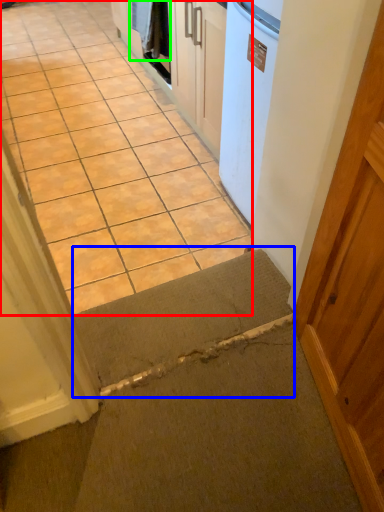
Question: Considering the real-world distances, which object is closest to concrete (highlighted by a red box)? doormat (highlighted by a blue box) or laundry (highlighted by a green box).

Choices:
 (A) doormat
 (B) laundry

Answer: (B)